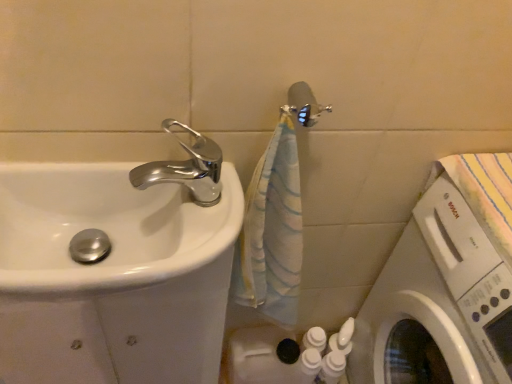
Question: Does white glossy sink at left have a lesser width compared to chrome metallic faucet at upper left?

Choices:
 (A) no
 (B) yes

Answer: (A)

Question: Is chrome metallic faucet at upper left a part of white glossy sink at left?

Choices:
 (A) no
 (B) yes

Answer: (A)

Question: Considering the relative sizes of white glossy sink at left and chrome metallic faucet at upper left in the image provided, is white glossy sink at left shorter than chrome metallic faucet at upper left?

Choices:
 (A) no
 (B) yes

Answer: (A)

Question: Does white glossy sink at left have a greater width compared to chrome metallic faucet at upper left?

Choices:
 (A) no
 (B) yes

Answer: (B)

Question: From a real-world perspective, is white glossy sink at left positioned under chrome metallic faucet at upper left based on gravity?

Choices:
 (A) no
 (B) yes

Answer: (B)

Question: Is white glossy sink at left taller than chrome metallic faucet at upper left?

Choices:
 (A) no
 (B) yes

Answer: (B)

Question: Does chrome metallic faucet at upper left have a greater height compared to metallic silver shower head at upper center?

Choices:
 (A) no
 (B) yes

Answer: (B)

Question: Is metallic silver shower head at upper center completely or partially inside chrome metallic faucet at upper left?

Choices:
 (A) yes
 (B) no

Answer: (B)

Question: Considering the relative positions of chrome metallic faucet at upper left and metallic silver shower head at upper center in the image provided, is chrome metallic faucet at upper left to the right of metallic silver shower head at upper center from the viewer's perspective?

Choices:
 (A) no
 (B) yes

Answer: (A)

Question: From a real-world perspective, is chrome metallic faucet at upper left located higher than metallic silver shower head at upper center?

Choices:
 (A) yes
 (B) no

Answer: (B)

Question: Is chrome metallic faucet at upper left bigger than metallic silver shower head at upper center?

Choices:
 (A) yes
 (B) no

Answer: (A)

Question: Could you tell me if chrome metallic faucet at upper left is facing metallic silver shower head at upper center?

Choices:
 (A) no
 (B) yes

Answer: (A)

Question: Does white glossy washing machine at lower right lie in front of metallic silver shower head at upper center?

Choices:
 (A) yes
 (B) no

Answer: (A)